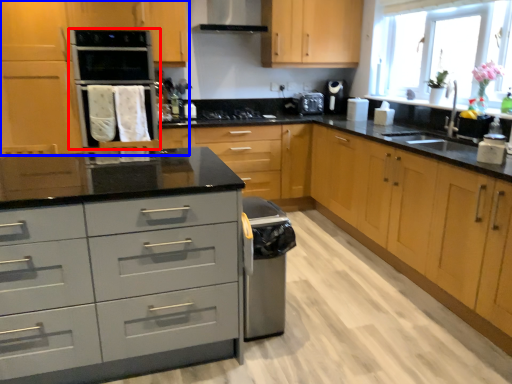
Question: Among these objects, which one is farthest to the camera, home appliance (highlighted by a red box) or cabinetry (highlighted by a blue box)?

Choices:
 (A) home appliance
 (B) cabinetry

Answer: (A)